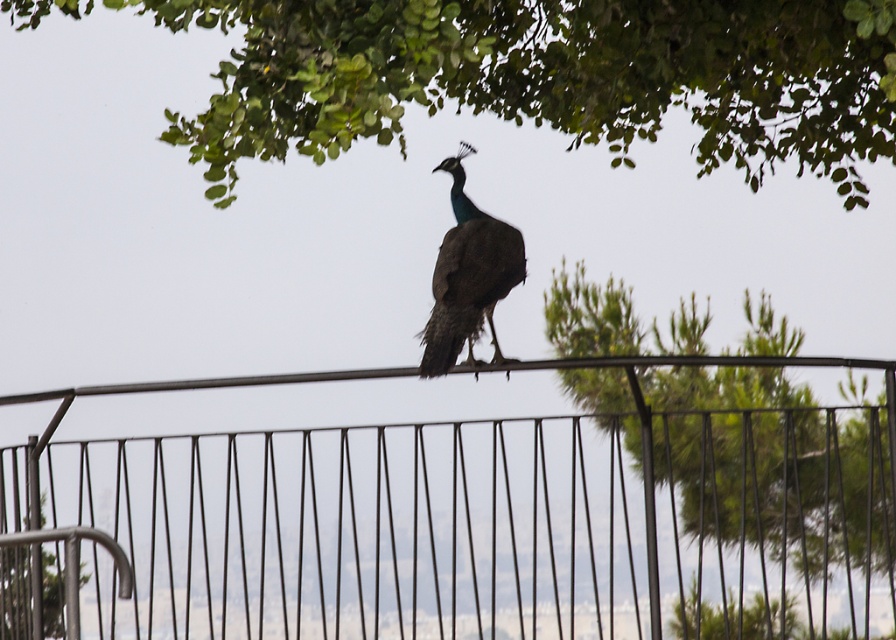
Question: Estimate the real-world distances between objects in this image. Which object is closer to the shiny blue peacock at center?

Choices:
 (A) green leafy tree at upper center
 (B) black metal fence at center

Answer: (A)

Question: In this image, where is green leafy tree at upper center located relative to shiny blue peacock at center?

Choices:
 (A) below
 (B) above

Answer: (B)

Question: Which of these objects is positioned closest to the black metal fence at center?

Choices:
 (A) green leafy tree at upper center
 (B) shiny blue peacock at center

Answer: (A)

Question: Is black metal fence at center to the right of green leafy tree at upper center from the viewer's perspective?

Choices:
 (A) yes
 (B) no

Answer: (A)

Question: Does green leafy tree at upper center have a larger size compared to shiny blue peacock at center?

Choices:
 (A) no
 (B) yes

Answer: (B)

Question: Estimate the real-world distances between objects in this image. Which object is farther from the shiny blue peacock at center?

Choices:
 (A) black metal fence at center
 (B) green leafy tree at upper center

Answer: (A)